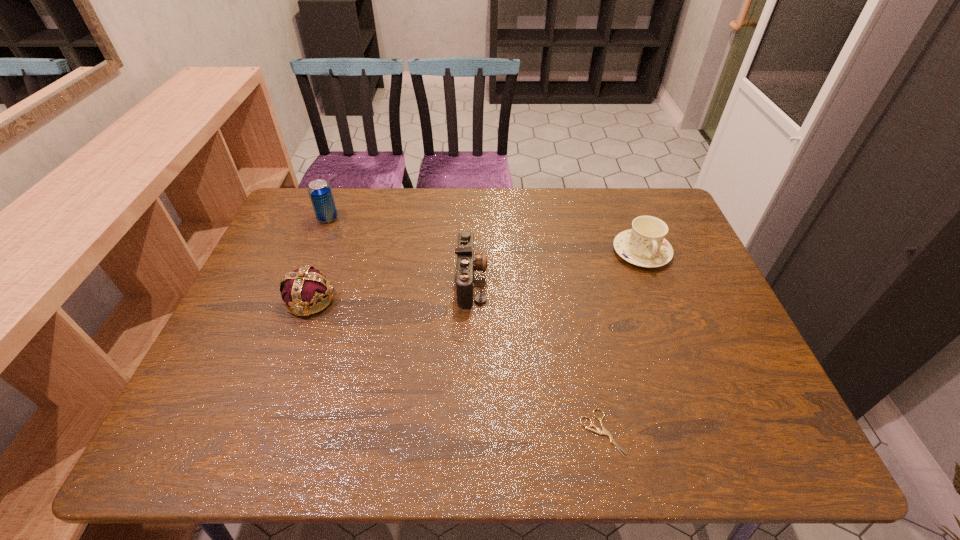
Find the location of `free space that satisfies the following two spatial constraints: 1. on the front side of the tallest object; 2. on the right side of the crown`. free space that satisfies the following two spatial constraints: 1. on the front side of the tallest object; 2. on the right side of the crown is located at coordinates (296, 299).